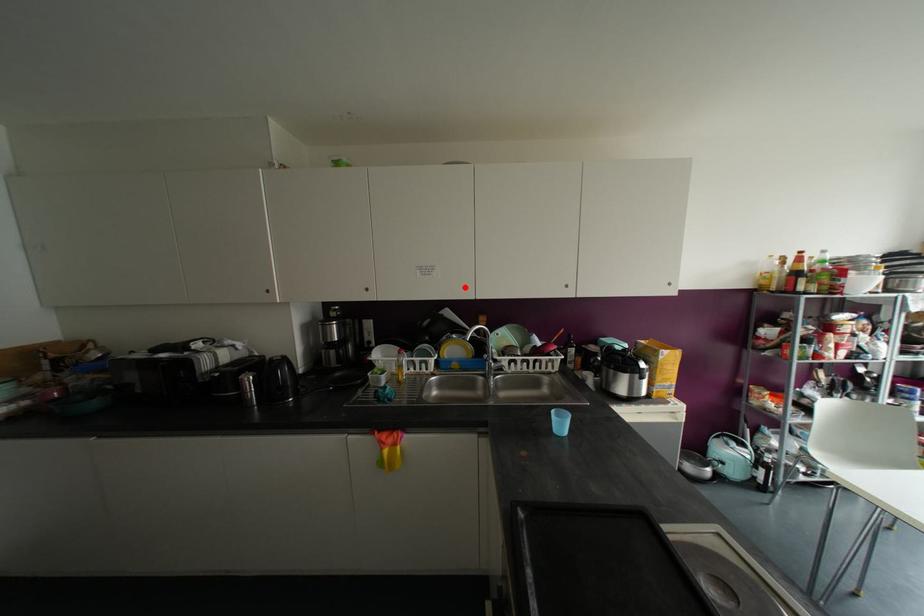
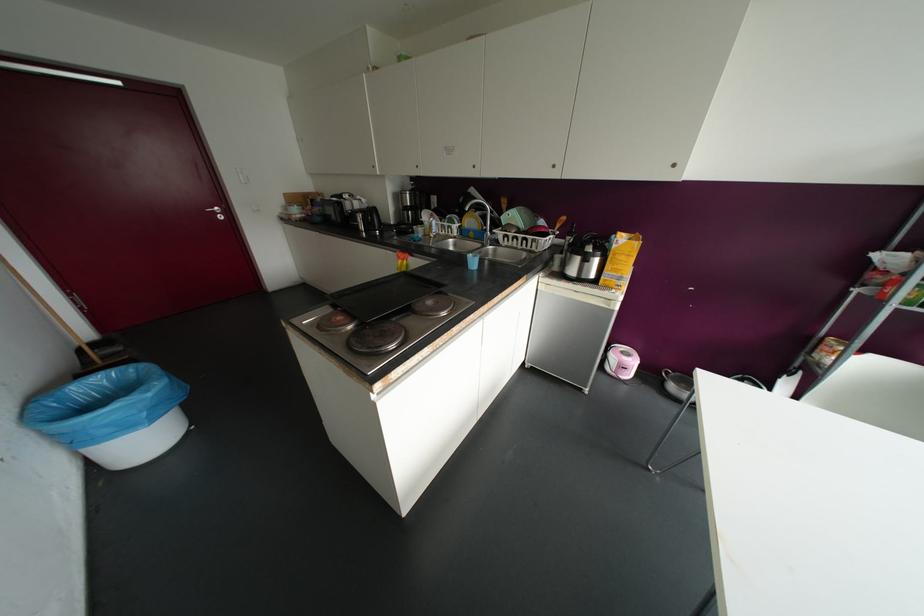
Question: A red point is marked in image1. In image2, is the corresponding 3D point closer to the camera or farther? Reply with the corresponding letter.

Choices:
 (A) The corresponding 3D point is closer.
 (B) The corresponding 3D point is farther.

Answer: (A)